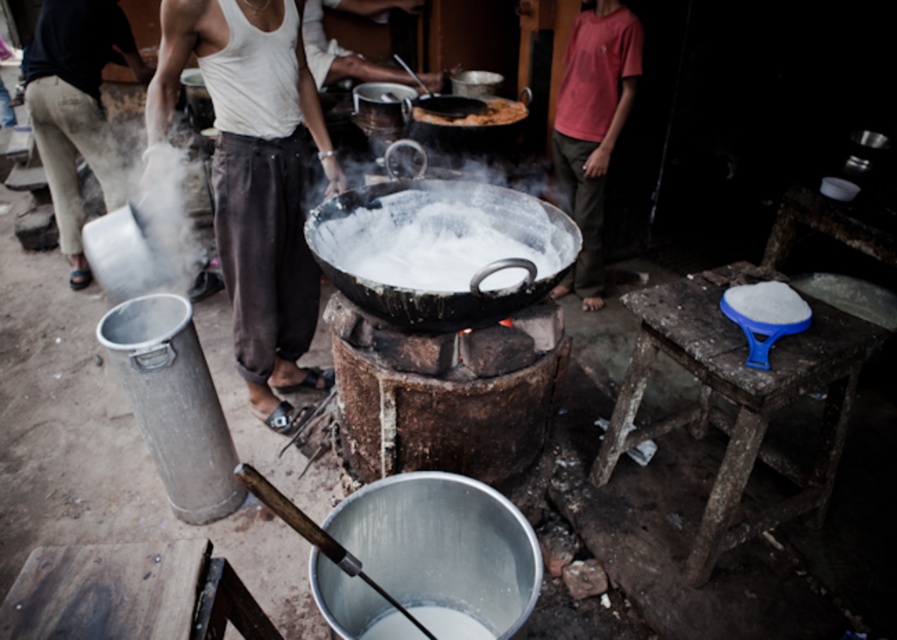
This screenshot has height=640, width=897. I want to click on red cotton shirt at right, so 591,125.

From the picture: Between red cotton shirt at right and brown matte flatbread at center, which one is positioned higher?

brown matte flatbread at center is above.

What do you see at coordinates (591, 125) in the screenshot? Image resolution: width=897 pixels, height=640 pixels. I see `red cotton shirt at right` at bounding box center [591, 125].

The image size is (897, 640). Find the location of `red cotton shirt at right`. red cotton shirt at right is located at coordinates (591, 125).

Can you confirm if blue plastic stool at lower right is positioned to the left of red cotton shirt at right?

In fact, blue plastic stool at lower right is to the right of red cotton shirt at right.

Who is higher up, blue plastic stool at lower right or red cotton shirt at right?

red cotton shirt at right

The image size is (897, 640). What do you see at coordinates (739, 397) in the screenshot?
I see `blue plastic stool at lower right` at bounding box center [739, 397].

In order to click on blue plastic stool at lower right in this screenshot , I will do `click(739, 397)`.

Is white vapor at left to the right of brown matte flatbread at center from the viewer's perspective?

No, white vapor at left is not to the right of brown matte flatbread at center.

Is point (129, 285) more distant than point (414, 113)?

That is True.

Locate an element on the screen. The width and height of the screenshot is (897, 640). white vapor at left is located at coordinates (120, 252).